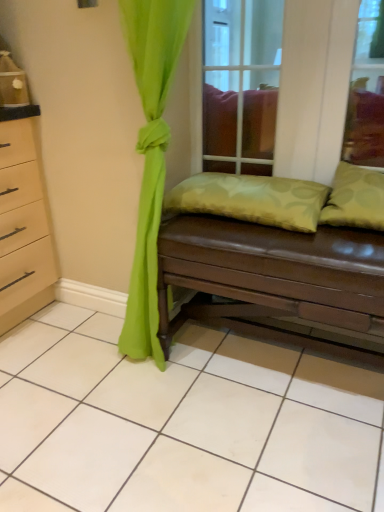
Question: Is transparent glass door at center at the left side of brown leather studio couch at center?

Choices:
 (A) no
 (B) yes

Answer: (B)

Question: Is transparent glass door at center positioned behind brown leather studio couch at center?

Choices:
 (A) no
 (B) yes

Answer: (B)

Question: Could brown leather studio couch at center be considered to be inside transparent glass door at center?

Choices:
 (A) yes
 (B) no

Answer: (B)

Question: From a real-world perspective, is transparent glass door at center on top of brown leather studio couch at center?

Choices:
 (A) no
 (B) yes

Answer: (B)

Question: Can you confirm if transparent glass door at center is shorter than brown leather studio couch at center?

Choices:
 (A) yes
 (B) no

Answer: (B)

Question: From a real-world perspective, is brown leather studio couch at center physically located above or below green textured pillow at center, the 2th pillow viewed from the right?

Choices:
 (A) below
 (B) above

Answer: (A)

Question: Based on their positions, is brown leather studio couch at center located to the left or right of green textured pillow at center, placed as the 1th pillow when sorted from left to right?

Choices:
 (A) right
 (B) left

Answer: (A)

Question: In terms of width, does brown leather studio couch at center look wider or thinner when compared to green textured pillow at center, placed as the 1th pillow when sorted from left to right?

Choices:
 (A) thin
 (B) wide

Answer: (B)

Question: Considering the positions of brown leather studio couch at center and green textured pillow at center, placed as the 1th pillow when sorted from left to right, in the image, is brown leather studio couch at center bigger or smaller than green textured pillow at center, placed as the 1th pillow when sorted from left to right,?

Choices:
 (A) small
 (B) big

Answer: (B)

Question: Considering the positions of point (160, 334) and point (344, 166), is point (160, 334) closer or farther from the camera than point (344, 166)?

Choices:
 (A) farther
 (B) closer

Answer: (A)

Question: Would you say brown leather studio couch at center is inside or outside green fabric pillow at right, acting as the 2th pillow starting from the left?

Choices:
 (A) inside
 (B) outside

Answer: (B)

Question: Considering the positions of brown leather studio couch at center and green fabric pillow at right, acting as the 2th pillow starting from the left, in the image, is brown leather studio couch at center bigger or smaller than green fabric pillow at right, acting as the 2th pillow starting from the left,?

Choices:
 (A) big
 (B) small

Answer: (A)

Question: From a real-world perspective, is brown leather studio couch at center positioned above or below green fabric pillow at right, acting as the 2th pillow starting from the left?

Choices:
 (A) below
 (B) above

Answer: (A)

Question: From the image's perspective, is transparent glass door at center positioned above or below green fabric pillow at right, acting as the 2th pillow starting from the left?

Choices:
 (A) above
 (B) below

Answer: (A)

Question: Is point (221, 166) positioned closer to the camera than point (324, 209)?

Choices:
 (A) closer
 (B) farther

Answer: (B)